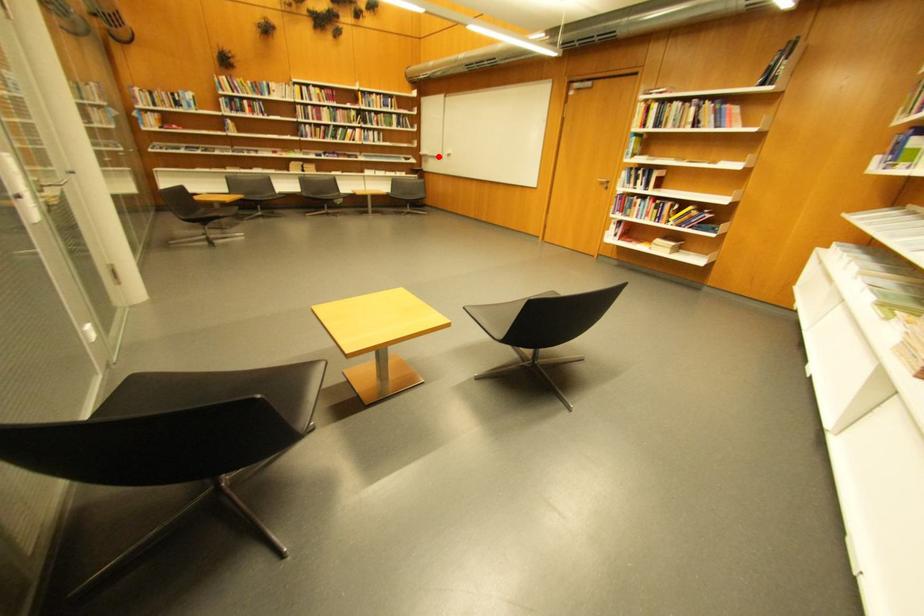
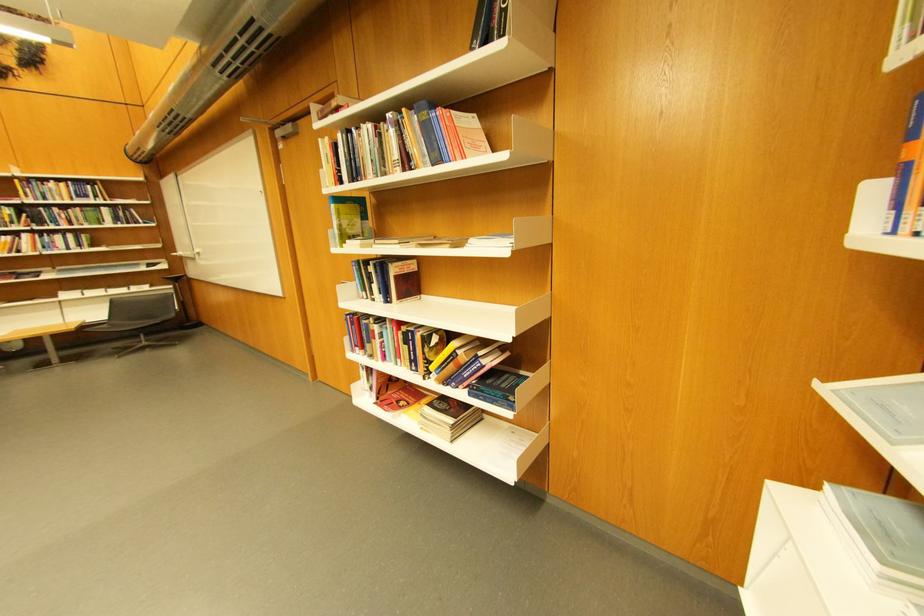
Find the pixel in the second image that matches the highlighted location in the first image.

(195, 257)